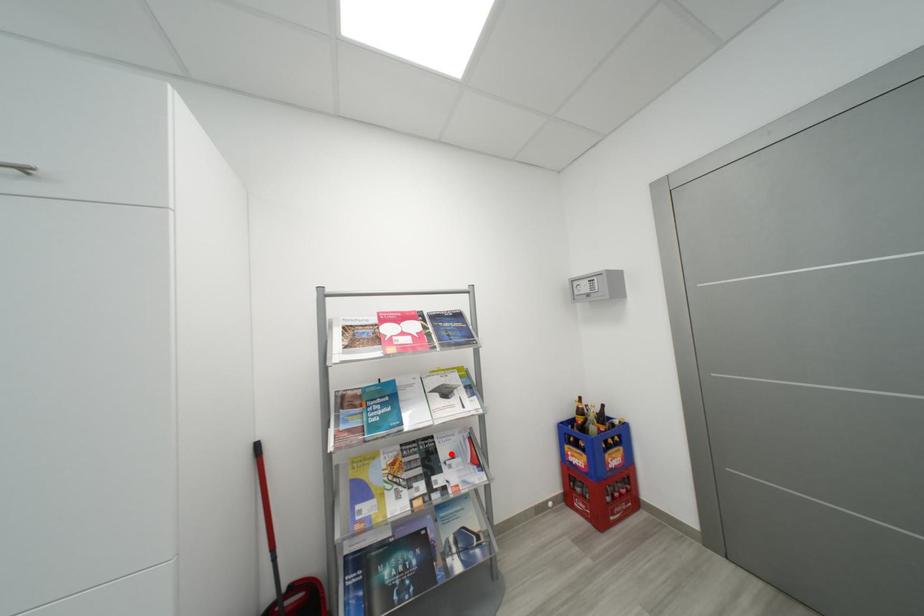
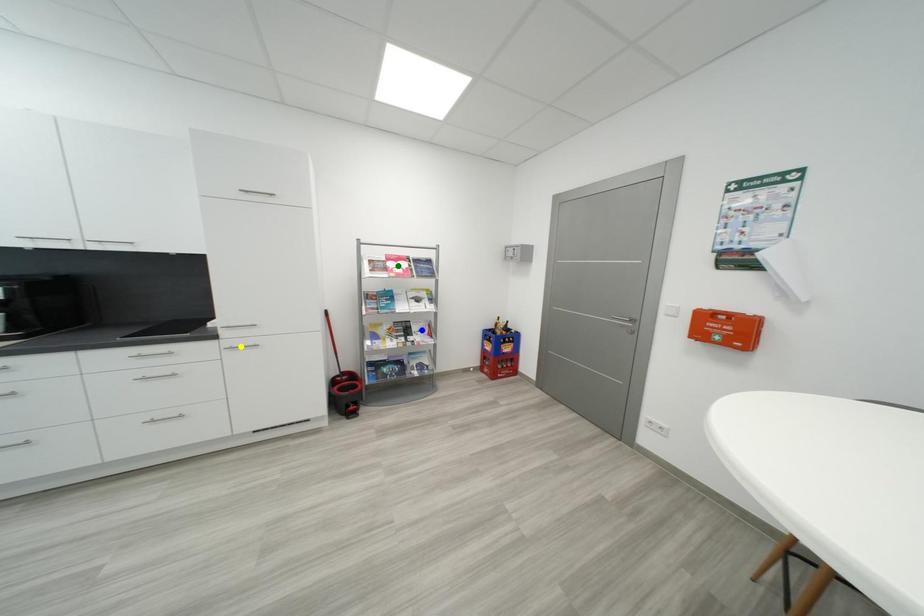
Question: I am providing you with two images of the same scene from different viewpoints. A red point is marked on the first image. You are given multiple points on the second image. In image 2, which mark is for the same physical point as the one in image 1?

Choices:
 (A) green point
 (B) yellow point
 (C) blue point

Answer: (C)